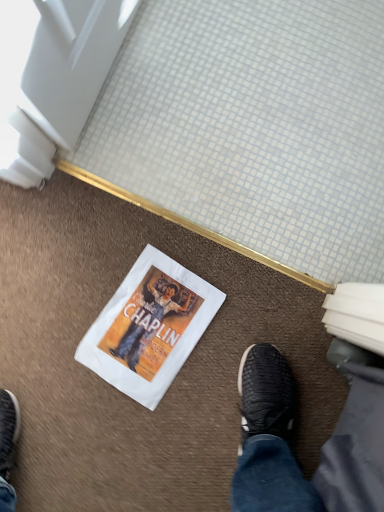
You are a GUI agent. You are given a task and a screenshot of the screen. Output one action in this format:
    pyautogui.click(x=<x>, y=<y>)
    Task: Click on the vacant area on top of white paper comic book at center (from a real-world perspective)
    
    Given the screenshot: What is the action you would take?
    pyautogui.click(x=148, y=327)